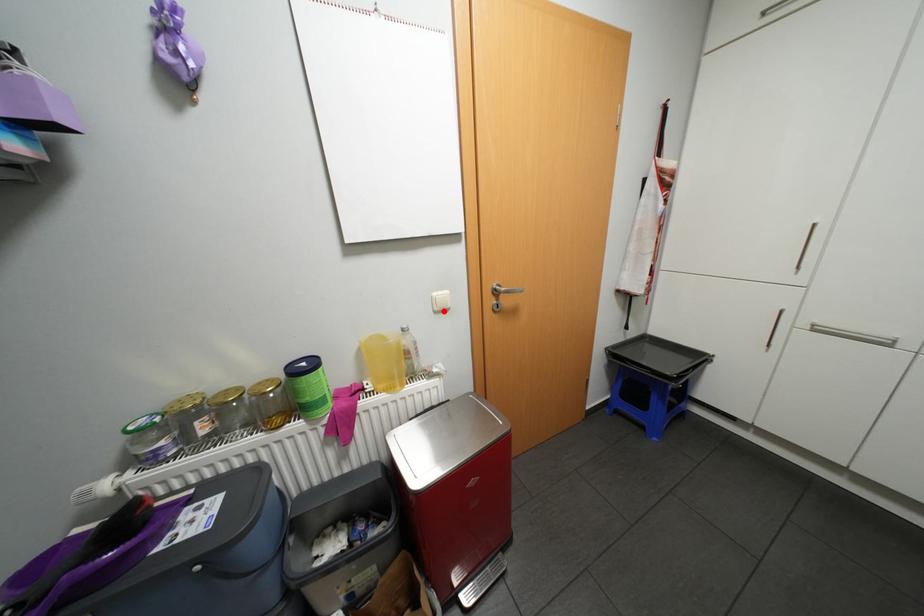
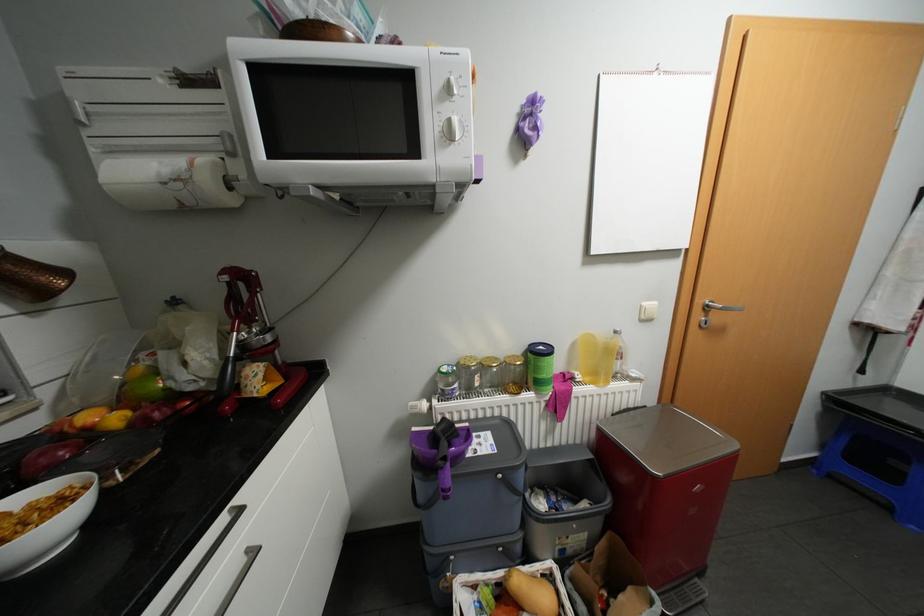
Question: I am providing you with two images of the same scene from different viewpoints. A red point is marked on the first image. At the location where the point appears in image 1, is it still visible in image 2?

Choices:
 (A) Yes
 (B) No

Answer: (A)